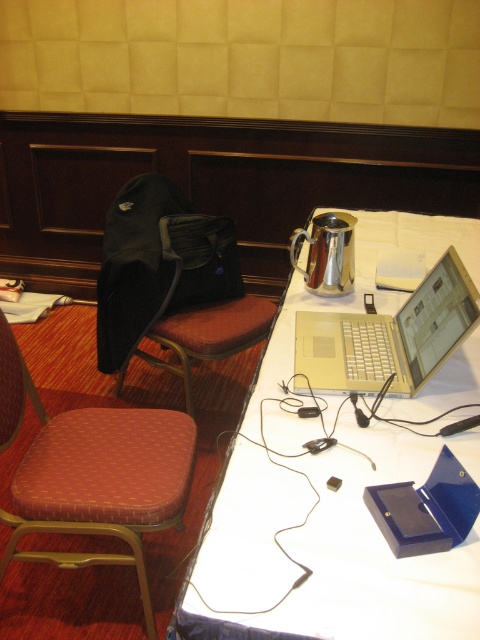
Question: Considering the relative positions of silver metallic table at center and red fabric chair at left in the image provided, where is silver metallic table at center located with respect to red fabric chair at left?

Choices:
 (A) left
 (B) right

Answer: (B)

Question: Estimate the real-world distances between objects in this image. Which object is farther from the silver metallic teapot at upper right?

Choices:
 (A) silver metallic table at center
 (B) black fabric bag at left
 (C) red fabric chair at left

Answer: (C)

Question: Is red fabric chair at left thinner than silver metallic teapot at upper right?

Choices:
 (A) no
 (B) yes

Answer: (A)

Question: Does silver metallic table at center have a greater width compared to silver metallic laptop at upper right?

Choices:
 (A) yes
 (B) no

Answer: (A)

Question: Which point is closer to the camera taking this photo?

Choices:
 (A) (309, 236)
 (B) (337, 429)
 (C) (184, 268)

Answer: (B)

Question: Which object is the closest to the silver metallic teapot at upper right?

Choices:
 (A) silver metallic laptop at upper right
 (B) silver metallic table at center

Answer: (B)